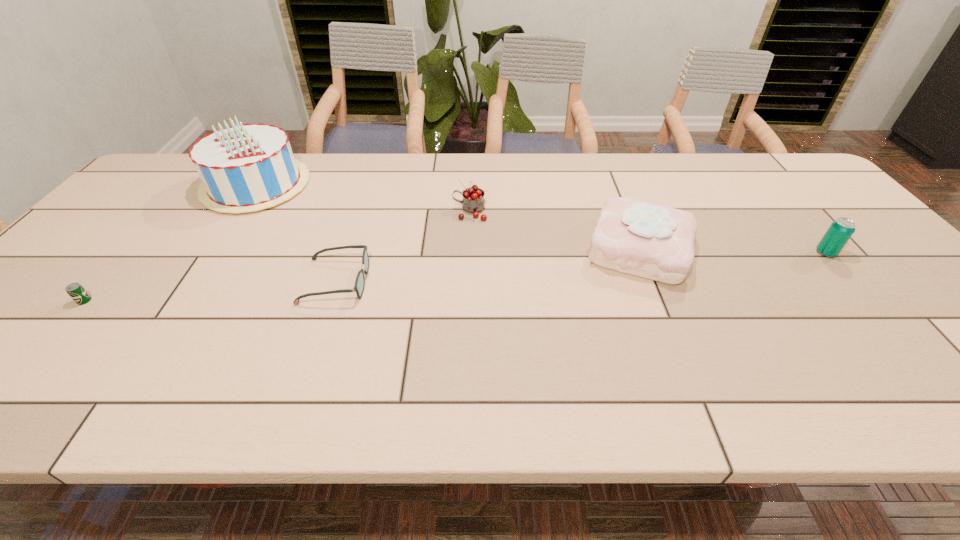
Find the location of `the fourth closest object to the spectacles`. the fourth closest object to the spectacles is located at coordinates (653, 241).

Locate which object is the fourth closest to the third object from left to right. Please provide its 2D coordinates. Your answer should be formatted as a tuple, i.e. [(x, y)], where the tuple contains the x and y coordinates of a point satisfying the conditions above.

[(653, 241)]

The width and height of the screenshot is (960, 540). In order to click on free space in the image that satisfies the following two spatial constraints: 1. on the back side of the left beer can; 2. on the left side of the cake in this screenshot , I will do `click(130, 248)`.